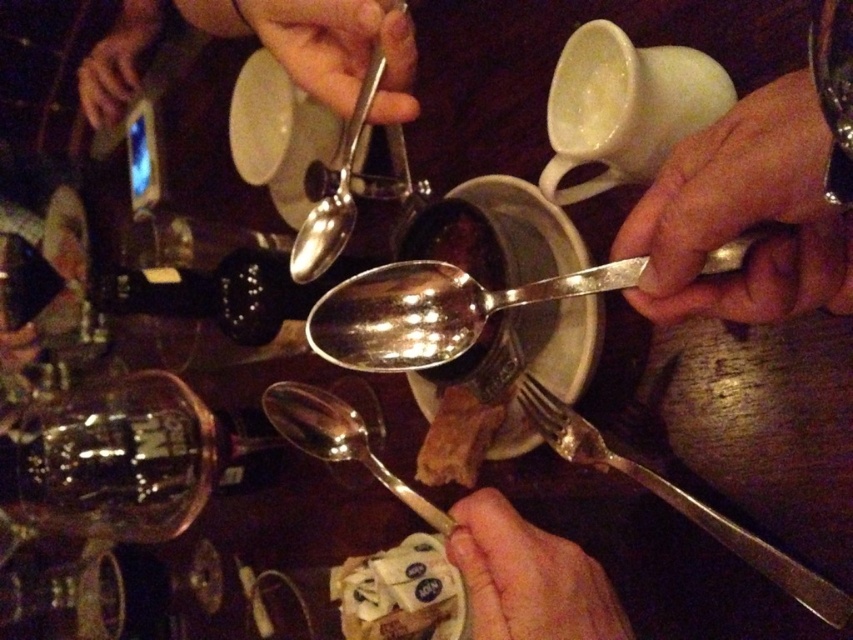
Which is behind, point (412, 612) or point (82, 100)?

Point (82, 100)

Does white sugar packets at lower center have a larger size compared to smooth skin hand at upper left?

Incorrect, white sugar packets at lower center is not larger than smooth skin hand at upper left.

Who is more distant from viewer, (457, 579) or (109, 120)?

Point (109, 120)

Identify the location of white sugar packets at lower center. (401, 593).

Is point (480, 403) farther from viewer compared to point (109, 83)?

No, it is in front of (109, 83).

Based on the photo, does brown crumbly bread at center come in front of smooth skin hand at upper left?

Yes, brown crumbly bread at center is closer to the viewer.

Does point (468, 433) lie in front of point (90, 115)?

Yes, it is.

Image resolution: width=853 pixels, height=640 pixels. I want to click on brown crumbly bread at center, so click(x=457, y=436).

Can you confirm if metallic spoon at upper center is taller than white sugar packets at lower center?

Correct, metallic spoon at upper center is much taller as white sugar packets at lower center.

Who is more forward, (293,45) or (416,557)?

Point (293,45) is in front.

Is point (131, 19) more distant than point (401, 605)?

Yes.

The width and height of the screenshot is (853, 640). Identify the location of metallic spoon at upper center. (323, 45).